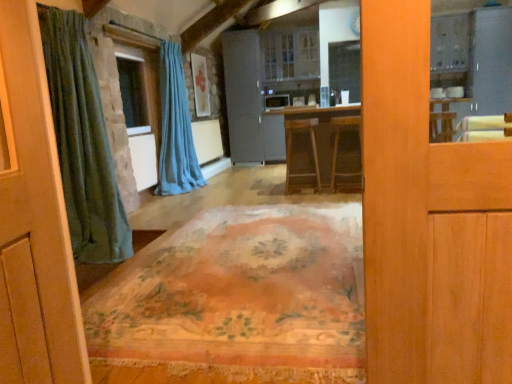
Question: Is wooden stool at center, which is counted as the 2th furniture, starting from the right, spatially inside wooden stool at center, the 2th furniture viewed from the left, or outside of it?

Choices:
 (A) inside
 (B) outside

Answer: (B)

Question: Considering the relative positions of wooden stool at center, which is counted as the 2th furniture, starting from the right, and wooden stool at center, the 2th furniture viewed from the left, in the image provided, is wooden stool at center, which is counted as the 2th furniture, starting from the right, to the left or to the right of wooden stool at center, the 2th furniture viewed from the left,?

Choices:
 (A) right
 (B) left

Answer: (B)

Question: Which is nearer to the matte gray cabinet at center?

Choices:
 (A) white glossy cabinet at upper right, the 1th screen door viewed from the right
 (B) stone window at center
 (C) wooden stool at center, the 2th furniture viewed from the left
 (D) wooden stool at center, which is counted as the 2th furniture, starting from the right
 (E) blue fabric curtain at center

Answer: (E)

Question: Which object is the closest to the white glossy cabinet at upper right, the 1th screen door viewed from the right?

Choices:
 (A) floral-patterned fabric at center
 (B) wooden stool at center, marked as the 1th furniture in a right-to-left arrangement
 (C) stone window at center
 (D) wooden stool at center, which is counted as the 2th furniture, starting from the right
 (E) matte gray cabinet at center

Answer: (B)